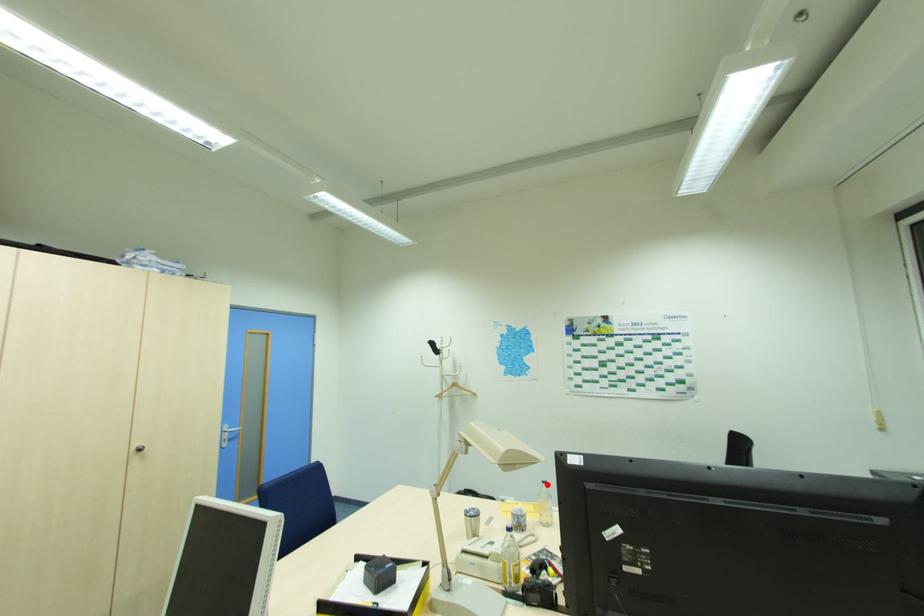
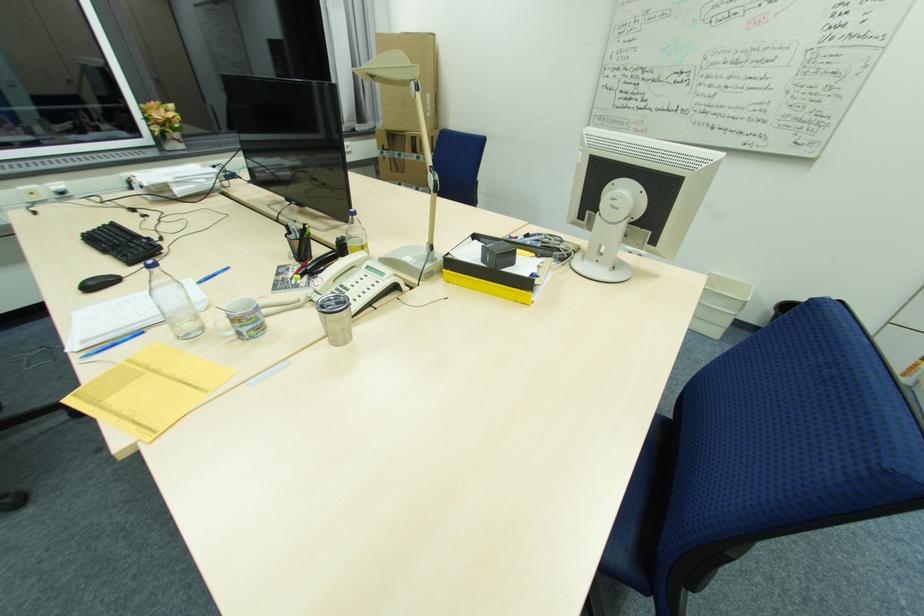
Question: I am providing you with two images of the same scene from different viewpoints. A red point is marked on the first image. At the location where the point appears in image 1, is it still visible in image 2?

Choices:
 (A) Yes
 (B) No

Answer: (A)